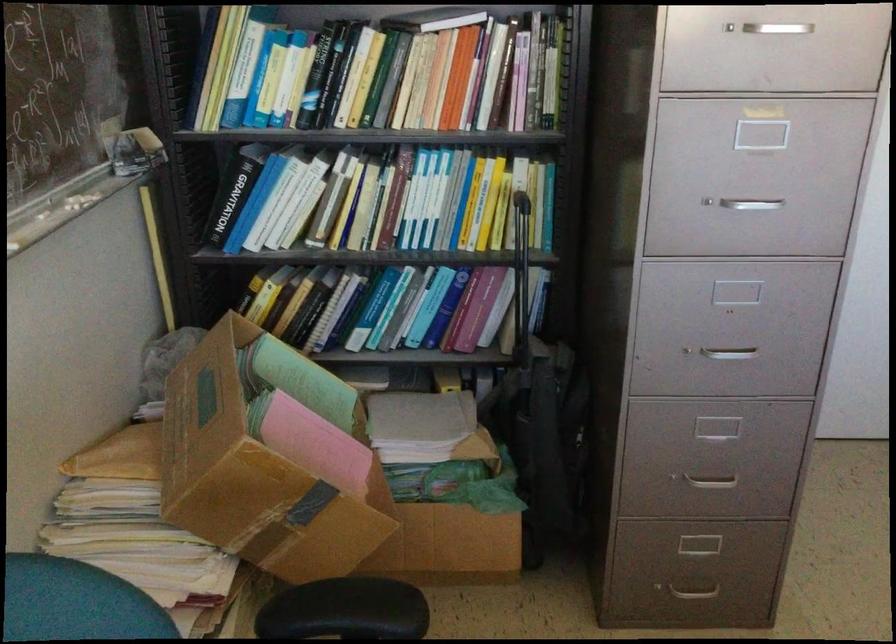
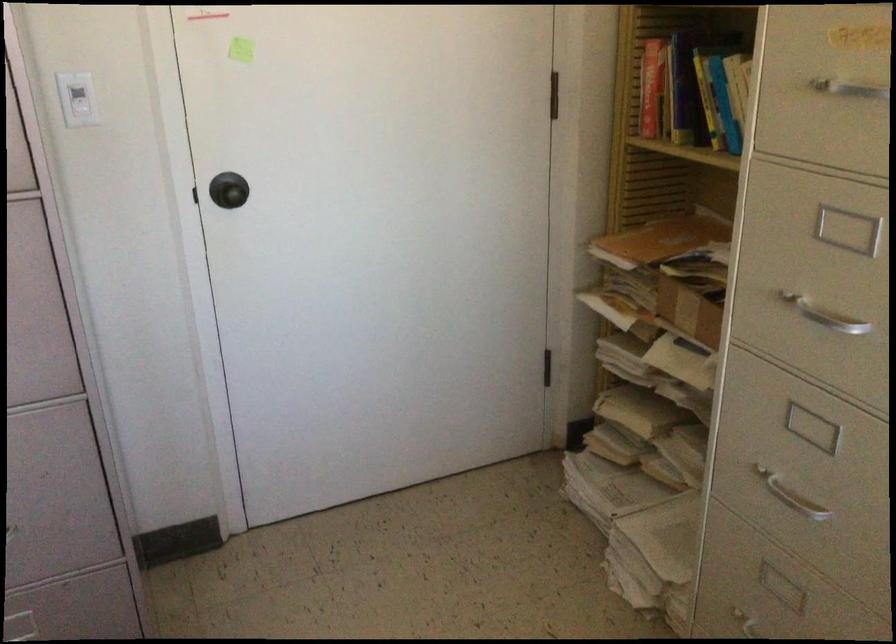
Question: The images are taken continuously from a first-person perspective. In which direction are you moving?

Choices:
 (A) Left
 (B) Right
 (C) Forward
 (D) Backward

Answer: (B)